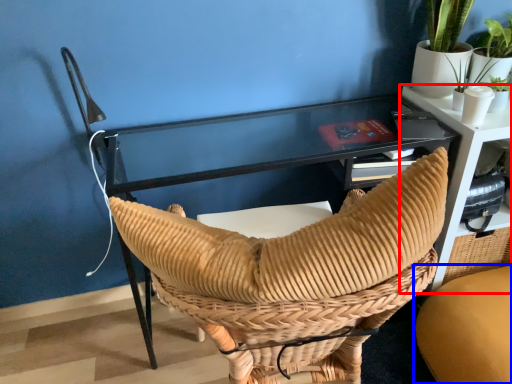
Question: Which object appears closest to the camera in this image, table (highlighted by a red box) or chair (highlighted by a blue box)?

Choices:
 (A) table
 (B) chair

Answer: (B)